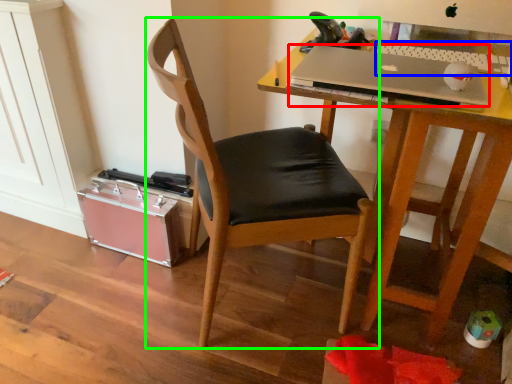
Question: Which is farther away from laptop (highlighted by a red box)? laptop keyboard (highlighted by a blue box) or chair (highlighted by a green box)?

Choices:
 (A) laptop keyboard
 (B) chair

Answer: (B)